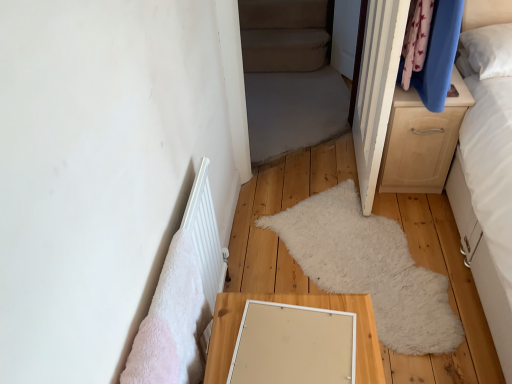
Question: Does point (391, 352) appear closer or farther from the camera than point (401, 147)?

Choices:
 (A) closer
 (B) farther

Answer: (A)

Question: Is wooden floor mat at center inside or outside of light wood/texture chest of drawers at right?

Choices:
 (A) outside
 (B) inside

Answer: (A)

Question: Which object is positioned closest to the light wood/texture table at lower center?

Choices:
 (A) beige fabric bed at center
 (B) white fluffy mat at center
 (C) white wood door at upper right
 (D) wooden floor mat at center
 (E) light wood/texture chest of drawers at right

Answer: (B)

Question: Which is nearer to the wooden floor mat at center?

Choices:
 (A) white wood door at upper right
 (B) white matte radiator at lower left
 (C) beige fabric bed at center
 (D) light wood/texture chest of drawers at right
 (E) white fluffy mat at center

Answer: (E)